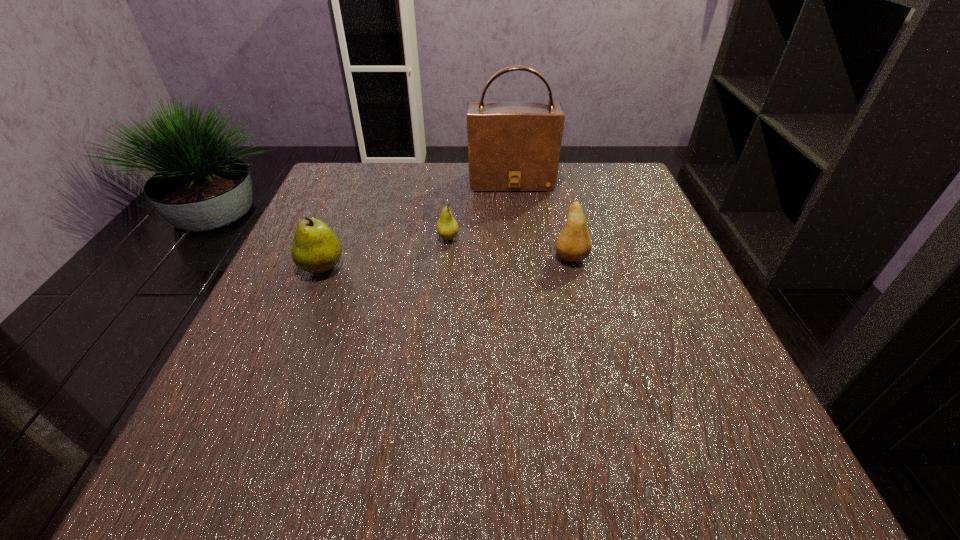
I want to click on vacant space in between the leftmost pear and the rightmost pear, so click(x=446, y=262).

Find the location of `vacant space in between the leftmost pear and the shortest object`. vacant space in between the leftmost pear and the shortest object is located at coordinates (385, 253).

Locate an element on the screen. vacant space that's between the farthest object and the leftmost object is located at coordinates (417, 224).

This screenshot has height=540, width=960. I want to click on free spot between the leftmost object and the rightmost pear, so click(x=446, y=262).

You are a GUI agent. You are given a task and a screenshot of the screen. Output one action in this format:
    pyautogui.click(x=<x>, y=<y>)
    Task: Click on the free point between the rightmost pear and the leftmost pear
    
    Given the screenshot: What is the action you would take?
    pyautogui.click(x=446, y=262)

Where is `vacant space that's between the shoulder bag and the farthest pear`? The width and height of the screenshot is (960, 540). vacant space that's between the shoulder bag and the farthest pear is located at coordinates (480, 210).

The width and height of the screenshot is (960, 540). I want to click on free space between the leftmost object and the shoulder bag, so click(x=417, y=224).

Where is `blank region between the rightmost pear and the farthest pear`? The width and height of the screenshot is (960, 540). blank region between the rightmost pear and the farthest pear is located at coordinates (510, 248).

At what (x,y) coordinates should I click in order to perform the action: click on vacant space in between the rightmost pear and the leftmost pear. Please return your answer as a coordinate pair (x, y). The image size is (960, 540). Looking at the image, I should click on point(446,262).

Choose which object is the nearest neighbor to the shortest object. Please provide its 2D coordinates. Your answer should be formatted as a tuple, i.e. [(x, y)], where the tuple contains the x and y coordinates of a point satisfying the conditions above.

[(512, 146)]